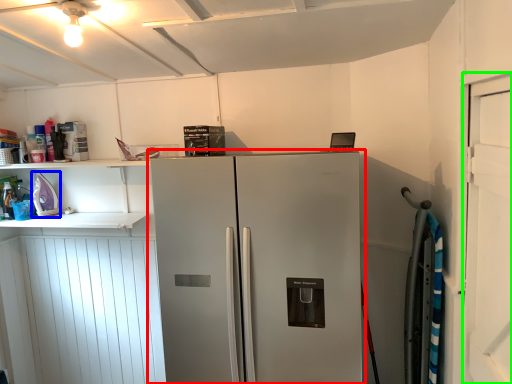
Question: Based on their relative distances, which object is nearer to refrigerator (highlighted by a red box)? Choose from appliance (highlighted by a blue box) and door (highlighted by a green box).

Choices:
 (A) appliance
 (B) door

Answer: (B)